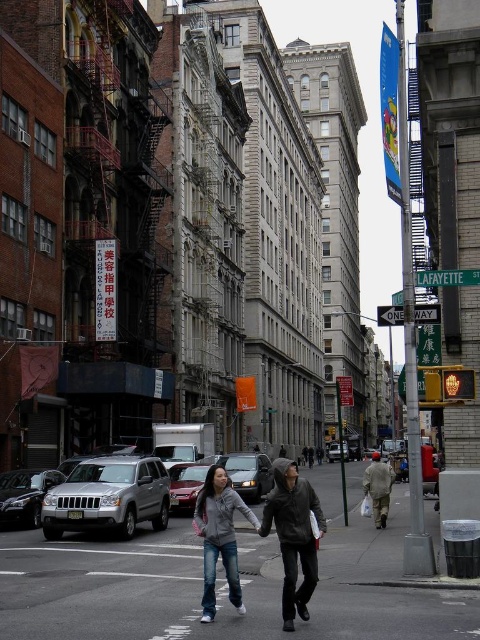
Is silver metallic suv at center positioned before silver metallic sedan at center?

Yes, silver metallic suv at center is closer to the viewer.

The width and height of the screenshot is (480, 640). What do you see at coordinates (108, 497) in the screenshot?
I see `silver metallic suv at center` at bounding box center [108, 497].

Is point (76, 508) positioned after point (328, 449)?

No, (76, 508) is closer to viewer.

Image resolution: width=480 pixels, height=640 pixels. I want to click on silver metallic suv at center, so click(108, 497).

Can you confirm if metallic silver sedan at center is positioned below gray hoodie at center?

No.

Can you confirm if metallic silver sedan at center is shorter than gray hoodie at center?

Correct, metallic silver sedan at center is not as tall as gray hoodie at center.

Which is behind, point (181, 502) or point (321, 464)?

The point (321, 464) is behind.

Where is `metallic silver sedan at center`? The height and width of the screenshot is (640, 480). metallic silver sedan at center is located at coordinates (186, 484).

What do you see at coordinates (260, 534) in the screenshot? The width and height of the screenshot is (480, 640). I see `gray cotton hoodie at center` at bounding box center [260, 534].

Does point (235, 552) lie behind point (159, 504)?

No, (235, 552) is in front of (159, 504).

What are the coordinates of `gray cotton hoodie at center` in the screenshot? It's located at (260, 534).